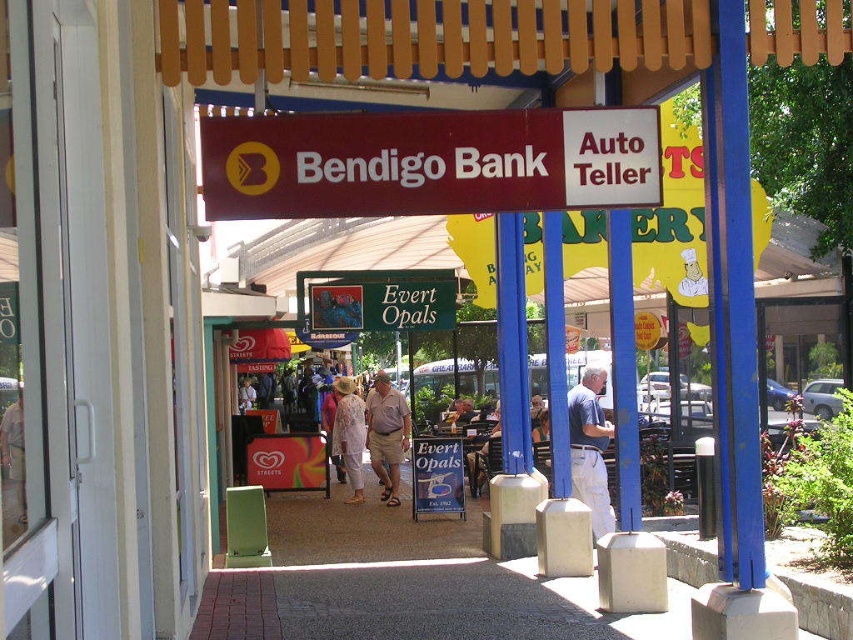
You are a fashion designer observing the clothing items displayed in the commercial area. Which clothing item at center has a bigger size between the khaki cotton shorts at center and the light beige floral dress at center?

The khaki cotton shorts at center has a larger size compared to the light beige floral dress at center.

You are a window shopper walking down the street and notice the maroon plastic sign at center and the light beige floral dress at center. Which object do you think is smaller in size?

The maroon plastic sign at center is smaller than the light beige floral dress at center.